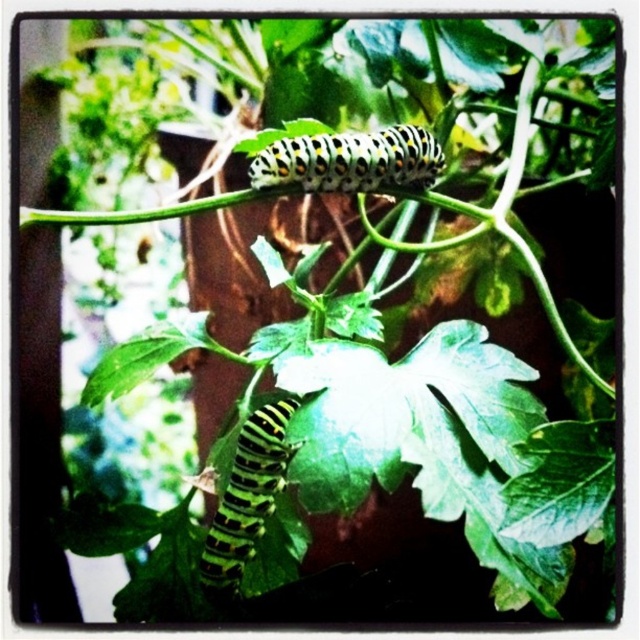
Which is behind, point (392, 168) or point (252, 460)?

Positioned behind is point (392, 168).

Measure the distance between green and black spotted caterpillar at upper center and black striped caterpillar at lower left.

16.82 inches

This screenshot has width=640, height=640. What are the coordinates of `green and black spotted caterpillar at upper center` in the screenshot? It's located at (349, 161).

Where is `green and black spotted caterpillar at upper center`? The width and height of the screenshot is (640, 640). green and black spotted caterpillar at upper center is located at coordinates (349, 161).